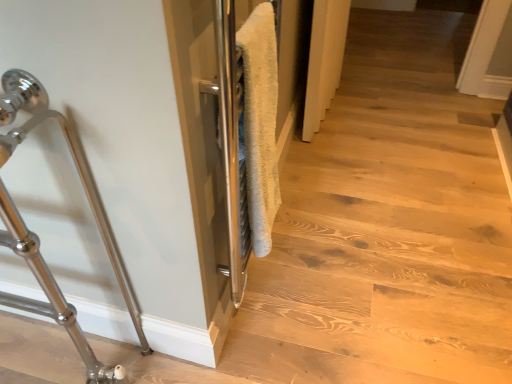
The image size is (512, 384). Describe the element at coordinates (48, 291) in the screenshot. I see `polished chrome shower at left` at that location.

In order to face polished chrome shower at left, should I rotate leftwards or rightwards?

A 32.094 degree turn to the left will do.

Where is `polished chrome shower at left`? polished chrome shower at left is located at coordinates (48, 291).

The width and height of the screenshot is (512, 384). In order to click on polished chrome shower at left in this screenshot , I will do `click(48, 291)`.